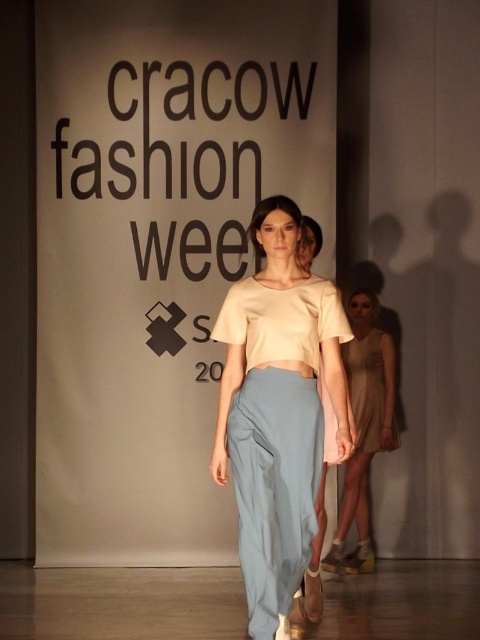
You are a fashion designer observing the runway show at Cracow Fashion Week. You notice the matte beige top at center and want to place a decorative pin on it. Given the coordinates provided, can you determine if the pin will be visible from the audience seated directly in front of the backdrop?

The matte beige top at center is located at point (277, 410), which is within the visible area of the model facing the audience. Therefore, the decorative pin placed there will be visible from the audience seated directly in front of the backdrop.

You are a photographer at the Cracow Fashion Week event. You need to capture a closeup shot of the matte beige top at center. Based on its position, where should you aim your camera relative to the model?

The matte beige top at center is located at point 0.642 on the horizontal axis and 0.579 on the vertical axis, so you should aim your camera slightly to the right and center vertically to capture the matte beige top at center effectively.